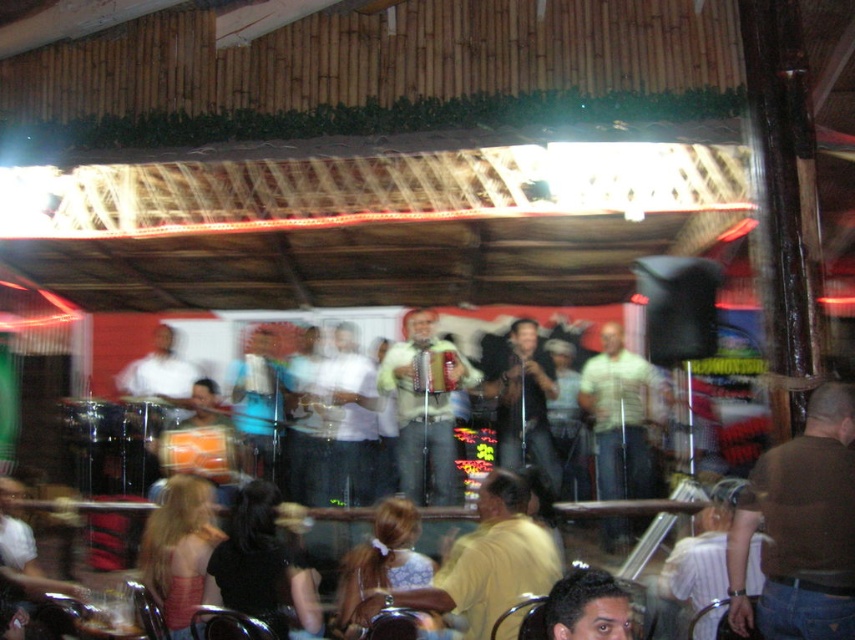
You are a photographer at the back of the venue and want to take a photo of the light brown leather accordion at center and the matte black shirt at center. Do you need to adjust your camera angle to ensure both are in frame?

The light brown leather accordion at center might be wider than matte black shirt at center, so you may need to adjust your camera angle to ensure both are fully visible in the photo.